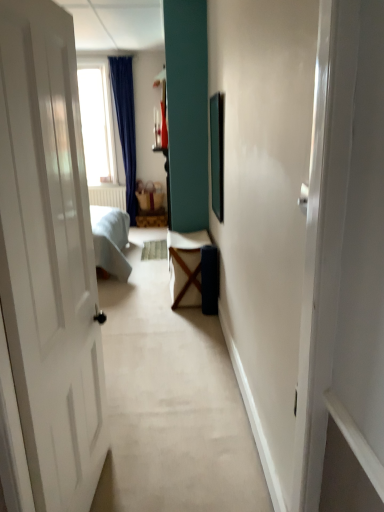
Question: In terms of width, does white fabric table at center look wider or thinner when compared to metallic silver picture frame at center?

Choices:
 (A) wide
 (B) thin

Answer: (A)

Question: Considering their positions, is white fabric table at center located in front of or behind metallic silver picture frame at center?

Choices:
 (A) behind
 (B) front

Answer: (A)

Question: Which object is the farthest from the metallic silver picture frame at center?

Choices:
 (A) matte brown basket at center
 (B) white fabric table at center

Answer: (A)

Question: Estimate the real-world distances between objects in this image. Which object is farther from the white fabric table at center?

Choices:
 (A) metallic silver picture frame at center
 (B) matte brown basket at center

Answer: (B)